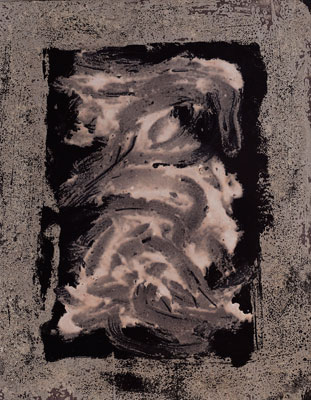
Locate an element on the screen. painting is located at coordinates (148, 206).